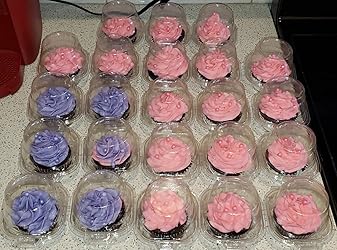
Identify the location of countertop. This screenshot has height=250, width=337. (10, 123).